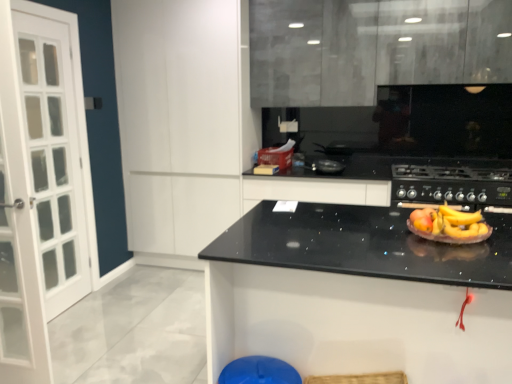
Question: Should I look upward or downward to see black matte gas stove at center?

Choices:
 (A) down
 (B) up

Answer: (B)

Question: From a real-world perspective, is matte black paper plate at center physically below black matte gas stove at center?

Choices:
 (A) no
 (B) yes

Answer: (A)

Question: From the image's perspective, is matte black paper plate at center under black matte gas stove at center?

Choices:
 (A) yes
 (B) no

Answer: (A)

Question: Is matte black paper plate at center positioned behind black matte gas stove at center?

Choices:
 (A) no
 (B) yes

Answer: (A)

Question: Is matte black paper plate at center to the right of black matte gas stove at center from the viewer's perspective?

Choices:
 (A) no
 (B) yes

Answer: (A)

Question: Is matte black paper plate at center touching black matte gas stove at center?

Choices:
 (A) yes
 (B) no

Answer: (B)

Question: Is black matte gas stove at center completely or partially inside matte black paper plate at center?

Choices:
 (A) yes
 (B) no

Answer: (B)

Question: Considering the relative positions of blue plastic bar stool at lower center and black granite countertop at center in the image provided, is blue plastic bar stool at lower center in front of black granite countertop at center?

Choices:
 (A) yes
 (B) no

Answer: (B)

Question: Does blue plastic bar stool at lower center have a larger size compared to black granite countertop at center?

Choices:
 (A) yes
 (B) no

Answer: (B)

Question: Is black granite countertop at center located within blue plastic bar stool at lower center?

Choices:
 (A) no
 (B) yes

Answer: (A)

Question: Are blue plastic bar stool at lower center and black granite countertop at center making contact?

Choices:
 (A) yes
 (B) no

Answer: (B)

Question: From a real-world perspective, is blue plastic bar stool at lower center positioned under black granite countertop at center based on gravity?

Choices:
 (A) yes
 (B) no

Answer: (A)

Question: From the image's perspective, is blue plastic bar stool at lower center on top of black granite countertop at center?

Choices:
 (A) yes
 (B) no

Answer: (B)

Question: Does black granite countertop at center appear on the left side of blue plastic bar stool at lower center?

Choices:
 (A) yes
 (B) no

Answer: (B)